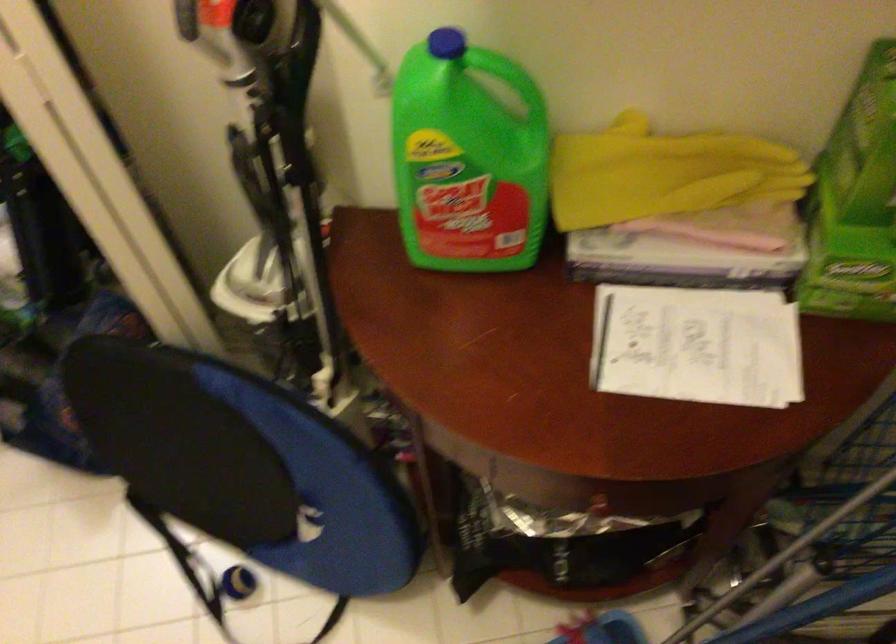
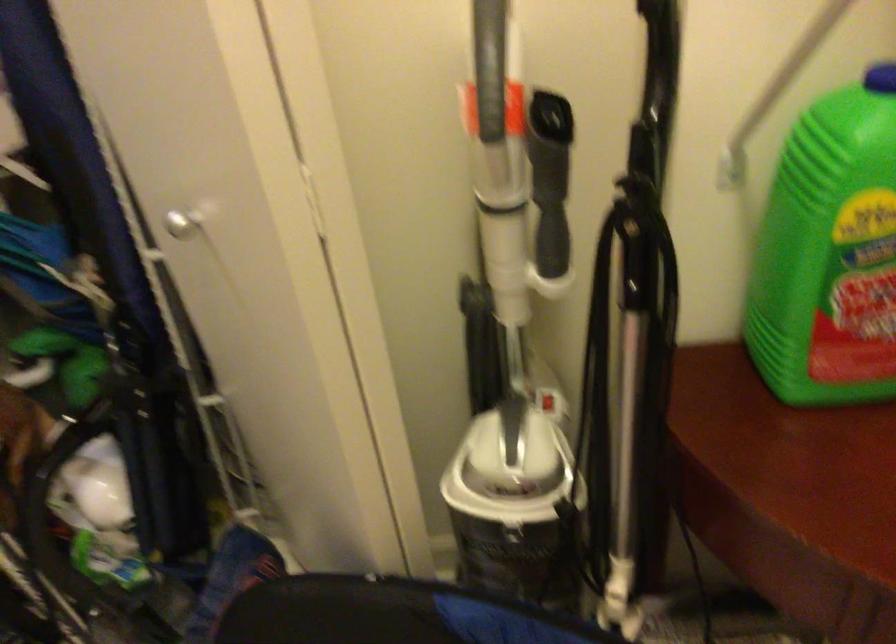
In the second image, find the point that corresponds to the point at 416,164 in the first image.

(830, 252)